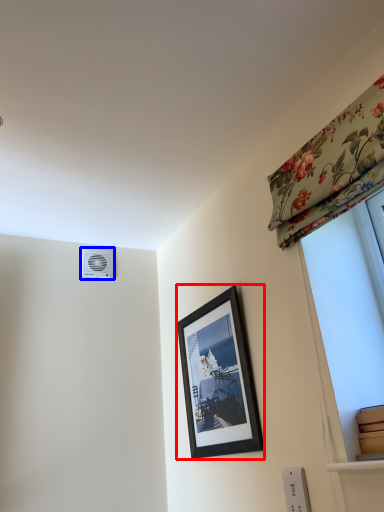
Question: Which of the following is the closest to the observer, picture frame (highlighted by a red box) or air conditioning (highlighted by a blue box)?

Choices:
 (A) picture frame
 (B) air conditioning

Answer: (A)